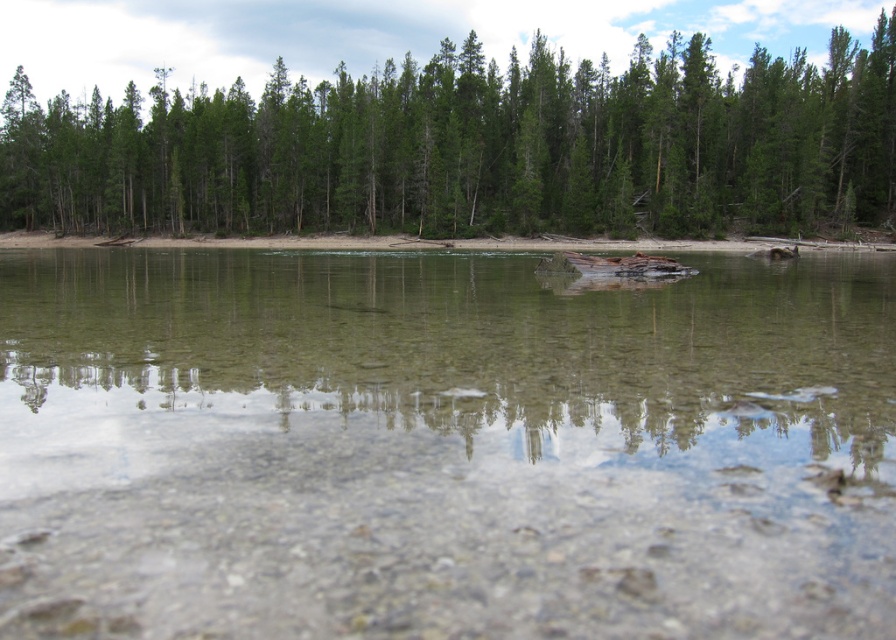
You are standing at the edge of the water and want to reach the point marked by point (x=442, y=448). Based on the scene, what will you find there?

The point (x=442, y=448) marks clear glass water at center, so you will find clear glass water there.

You are standing at the center of the image and want to take a photo of the green matte trees at upper center. In which direction should you point your camera to capture them?

The green matte trees at upper center are located at point (x=474, y=147), so you should point your camera slightly to the left and upwards to capture them.

You are an environmental scientist analyzing the image. You need to determine which area covers more ground between the clear glass water at center and the brown dirt shoreline at center. Based on the scene, which one is larger?

The brown dirt shoreline at center occupies more space than the clear glass water at center according to the description.